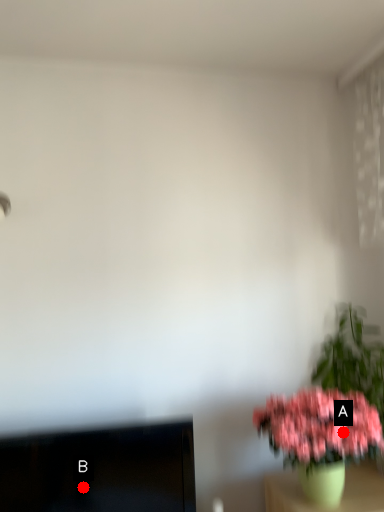
Question: Two points are circled on the image, labeled by A and B beside each circle. Among these points, which one is farthest from the camera?

Choices:
 (A) A is further
 (B) B is further

Answer: (B)